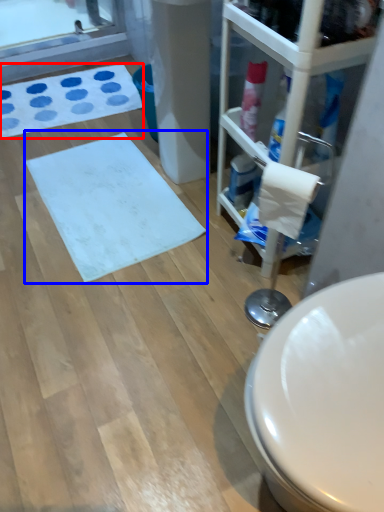
Question: Which of the following is the farthest to the observer, bath mat (highlighted by a red box) or bath mat (highlighted by a blue box)?

Choices:
 (A) bath mat
 (B) bath mat

Answer: (A)